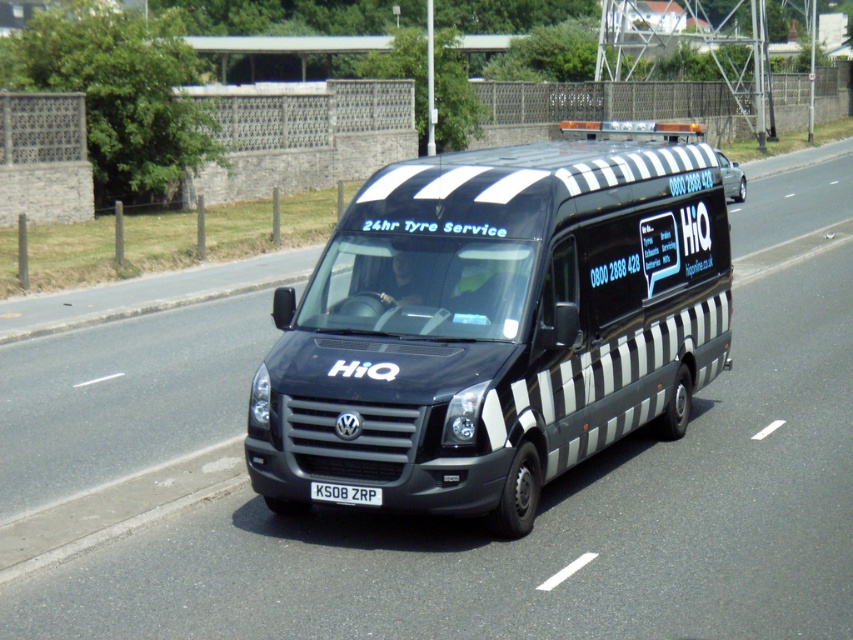
Question: Is matte black van at center smaller than black metallic license plate at center?

Choices:
 (A) no
 (B) yes

Answer: (A)

Question: Is matte black van at center to the right of black metallic license plate at center from the viewer's perspective?

Choices:
 (A) no
 (B) yes

Answer: (B)

Question: Which of the following is the closest to the observer?

Choices:
 (A) (604, 436)
 (B) (358, 496)

Answer: (B)

Question: Which point appears closest to the camera in this image?

Choices:
 (A) (323, 499)
 (B) (442, 406)

Answer: (B)

Question: Does matte black van at center appear on the left side of black metallic license plate at center?

Choices:
 (A) yes
 (B) no

Answer: (B)